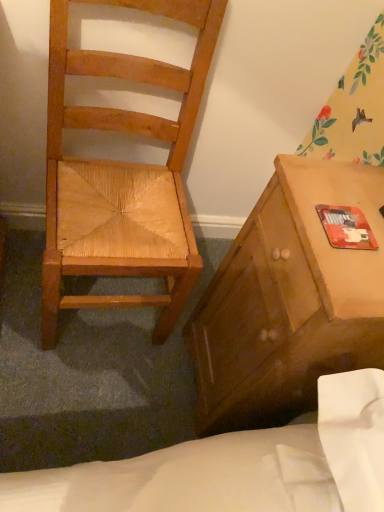
Consider the image. In order to face red matte mouse pad at right, should I rotate leftwards or rightwards?

It's best to rotate right around 20.126 degrees.

Image resolution: width=384 pixels, height=512 pixels. Describe the element at coordinates (346, 227) in the screenshot. I see `red matte mouse pad at right` at that location.

I want to click on matte wooden cabinet at right, so click(x=289, y=301).

What are the coordinates of `chair that appears on the left of red matte mouse pad at right` in the screenshot? It's located at (122, 174).

Consider the image. Between red matte mouse pad at right and natural wood chair at left, which one has smaller width?

red matte mouse pad at right.

Is red matte mouse pad at right positioned in front of natural wood chair at left?

No, it is behind natural wood chair at left.

From a real-world perspective, is red matte mouse pad at right located higher than natural wood chair at left?

Yes, from a real-world perspective, red matte mouse pad at right is above natural wood chair at left.

What's the angular difference between natural wood chair at left and red matte mouse pad at right's facing directions?

89.3 degrees.

Which of these two, natural wood chair at left or red matte mouse pad at right, stands taller?

natural wood chair at left.

Is the surface of natural wood chair at left in direct contact with red matte mouse pad at right?

No, natural wood chair at left is not touching red matte mouse pad at right.

Which object is more forward, matte wooden cabinet at right or natural wood chair at left?

natural wood chair at left.

Considering the positions of objects matte wooden cabinet at right and natural wood chair at left in the image provided, who is more to the left, matte wooden cabinet at right or natural wood chair at left?

From the viewer's perspective, natural wood chair at left appears more on the left side.

Considering the sizes of objects matte wooden cabinet at right and natural wood chair at left in the image provided, who is wider, matte wooden cabinet at right or natural wood chair at left?

Wider between the two is natural wood chair at left.

Is point (255, 247) closer or farther from the camera than point (163, 216)?

Point (255, 247).

Where is `cabinetry below the red matte mouse pad at right (from a real-world perspective)`? The width and height of the screenshot is (384, 512). cabinetry below the red matte mouse pad at right (from a real-world perspective) is located at coordinates (289, 301).

From the image's perspective, is matte wooden cabinet at right beneath red matte mouse pad at right?

Indeed, from the image's perspective, matte wooden cabinet at right is shown beneath red matte mouse pad at right.

Does matte wooden cabinet at right lie in front of red matte mouse pad at right?

Yes, matte wooden cabinet at right is closer to the camera.

Is matte wooden cabinet at right with red matte mouse pad at right?

No, matte wooden cabinet at right is not making contact with red matte mouse pad at right.

Is red matte mouse pad at right completely or partially outside of matte wooden cabinet at right?

No, most part of red matte mouse pad at right lies within matte wooden cabinet at right.

Is red matte mouse pad at right far from matte wooden cabinet at right?

No, there isn't a large distance between red matte mouse pad at right and matte wooden cabinet at right.

Locate an element on the screen. This screenshot has width=384, height=512. cabinetry on the left of red matte mouse pad at right is located at coordinates (289, 301).

Is matte wooden cabinet at right at the back of natural wood chair at left?

natural wood chair at left does not have its back to matte wooden cabinet at right.

Looking at this image, between natural wood chair at left and matte wooden cabinet at right, which one has less height?

matte wooden cabinet at right.

Consider the image. Looking at their sizes, would you say natural wood chair at left is wider or thinner than matte wooden cabinet at right?

In the image, natural wood chair at left appears to be wider than matte wooden cabinet at right.

From a real-world perspective, is natural wood chair at left positioned under matte wooden cabinet at right based on gravity?

No, from a real-world perspective, natural wood chair at left is not below matte wooden cabinet at right.

Find the location of a particular element. The width and height of the screenshot is (384, 512). chair on the left of red matte mouse pad at right is located at coordinates (122, 174).

This screenshot has height=512, width=384. Find the location of `chair located underneath the red matte mouse pad at right (from a real-world perspective)`. chair located underneath the red matte mouse pad at right (from a real-world perspective) is located at coordinates (122, 174).

Estimate the real-world distances between objects in this image. Which object is closer to matte wooden cabinet at right, natural wood chair at left or red matte mouse pad at right?

red matte mouse pad at right.

Looking at the image, which one is located closer to red matte mouse pad at right, matte wooden cabinet at right or natural wood chair at left?

Based on the image, matte wooden cabinet at right appears to be nearer to red matte mouse pad at right.

Which object lies nearer to the anchor point natural wood chair at left, red matte mouse pad at right or matte wooden cabinet at right?

Among the two, matte wooden cabinet at right is located nearer to natural wood chair at left.

Based on their spatial positions, is matte wooden cabinet at right or red matte mouse pad at right closer to natural wood chair at left?

Based on the image, matte wooden cabinet at right appears to be nearer to natural wood chair at left.

From the image, which object appears to be farther from matte wooden cabinet at right, red matte mouse pad at right or natural wood chair at left?

natural wood chair at left is further to matte wooden cabinet at right.

Estimate the real-world distances between objects in this image. Which object is closer to red matte mouse pad at right, natural wood chair at left or matte wooden cabinet at right?

matte wooden cabinet at right.

Where is `cabinetry between natural wood chair at left and red matte mouse pad at right in the horizontal direction`? Image resolution: width=384 pixels, height=512 pixels. cabinetry between natural wood chair at left and red matte mouse pad at right in the horizontal direction is located at coordinates (289, 301).